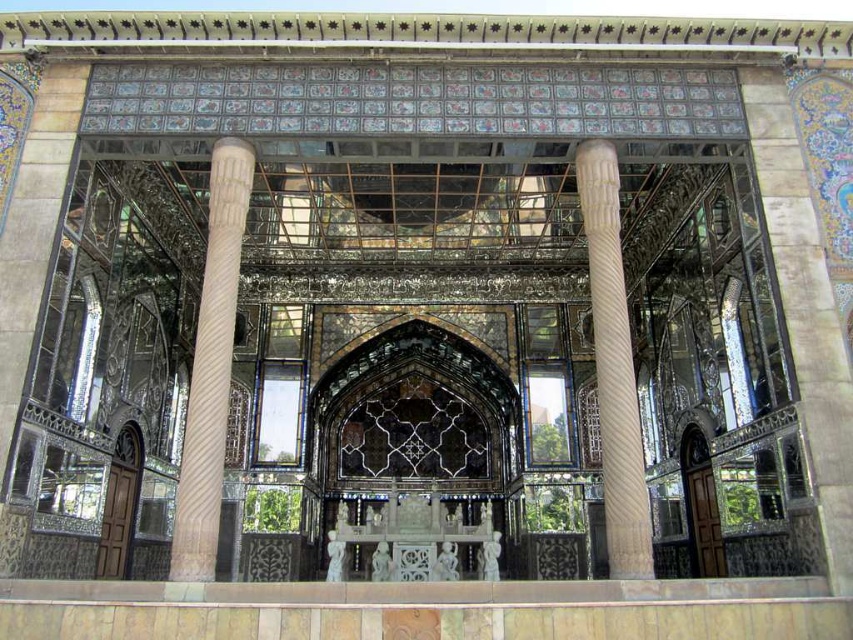
Is point (189, 401) positioned before point (650, 557)?

No, (189, 401) is further to viewer.

What do you see at coordinates (212, 365) in the screenshot?
I see `white marble column at center` at bounding box center [212, 365].

Locate an element on the screen. The width and height of the screenshot is (853, 640). white marble column at center is located at coordinates click(x=212, y=365).